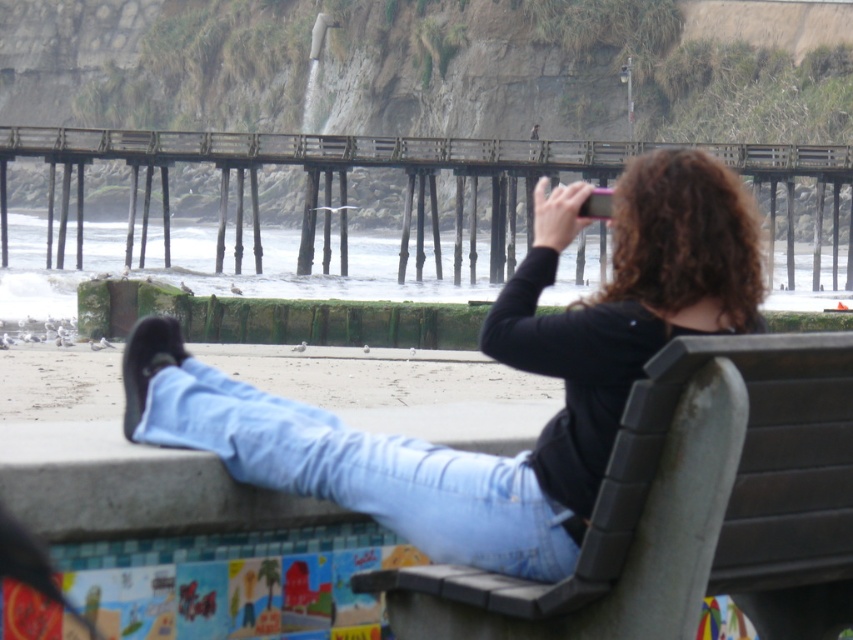
You are a photographer standing at the beach scene. You want to take a photo that includes both the black matte shirt at upper center and the wooden pier at center. Given that your camera has a maximum zoom range of 50 feet, can you capture both objects in a single frame without moving your position?

The black matte shirt at upper center is 38.82 feet from the wooden pier at center. Since your camera can zoom up to 50 feet, which is greater than the distance between them, you can capture both objects in a single frame without moving.

You are standing at the center of the beach scene and see the gray plastic bench at lower right and the light blue denim jeans at lower center. Which object is positioned more to the east?

The gray plastic bench at lower right is to the right of light blue denim jeans at lower center, so it is positioned more to the east.